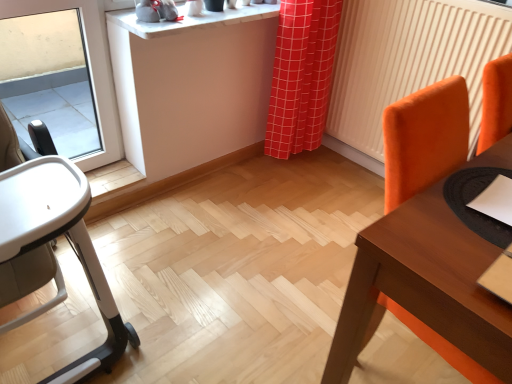
I want to click on vacant space that's between beige fabric highchair at left and red checkered curtain at center, so click(x=199, y=230).